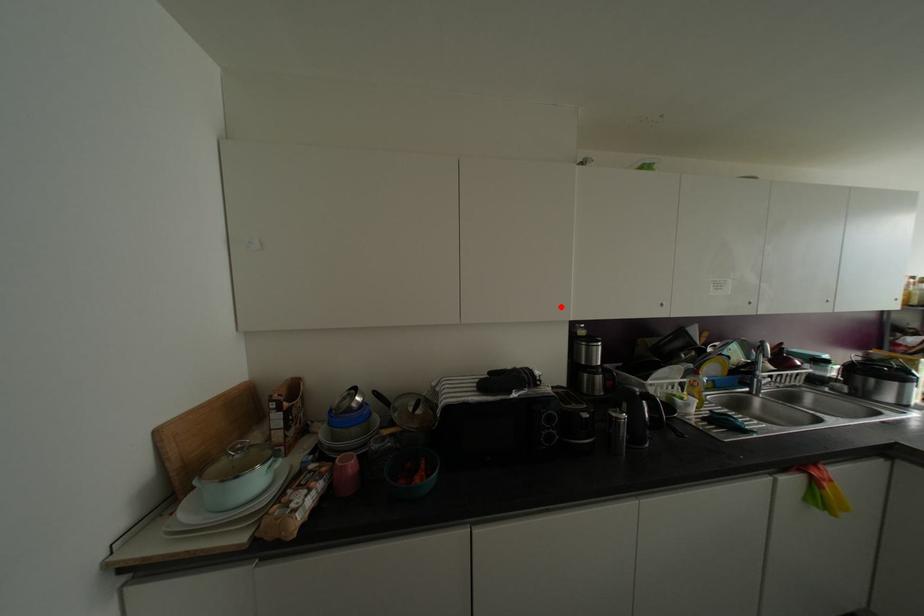
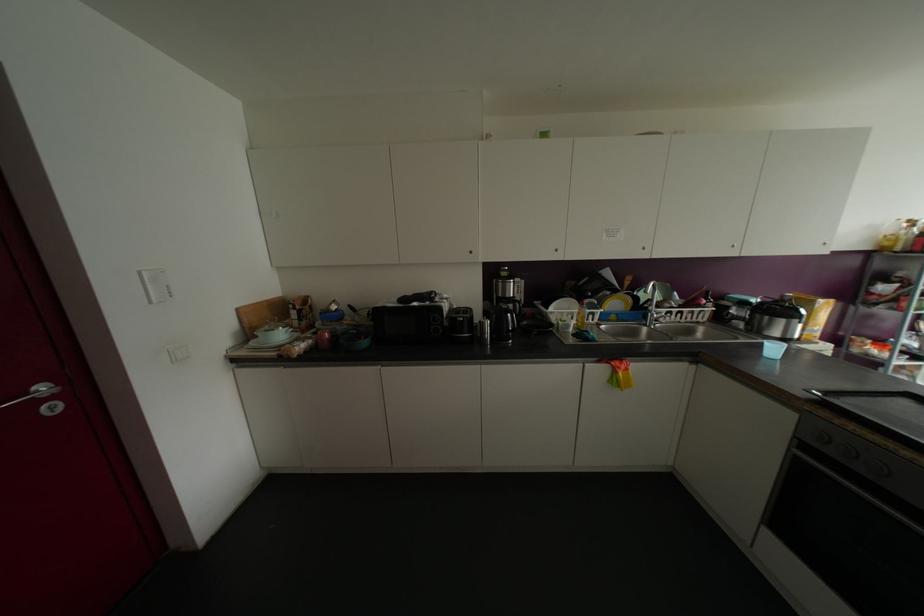
In the second image, find the point that corresponds to the highlighted location in the first image.

(469, 252)